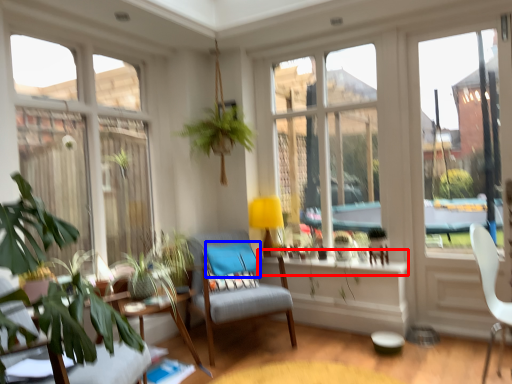
Question: Which object appears closest to the camera in this image, window sill (highlighted by a red box) or pillow (highlighted by a blue box)?

Choices:
 (A) window sill
 (B) pillow

Answer: (A)